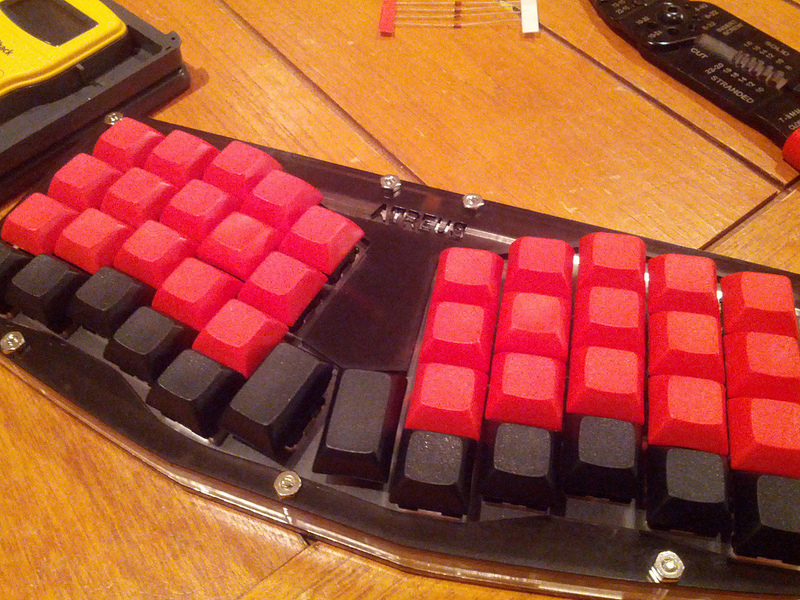
Where is `computer keyboard`? computer keyboard is located at coordinates pos(398,339).